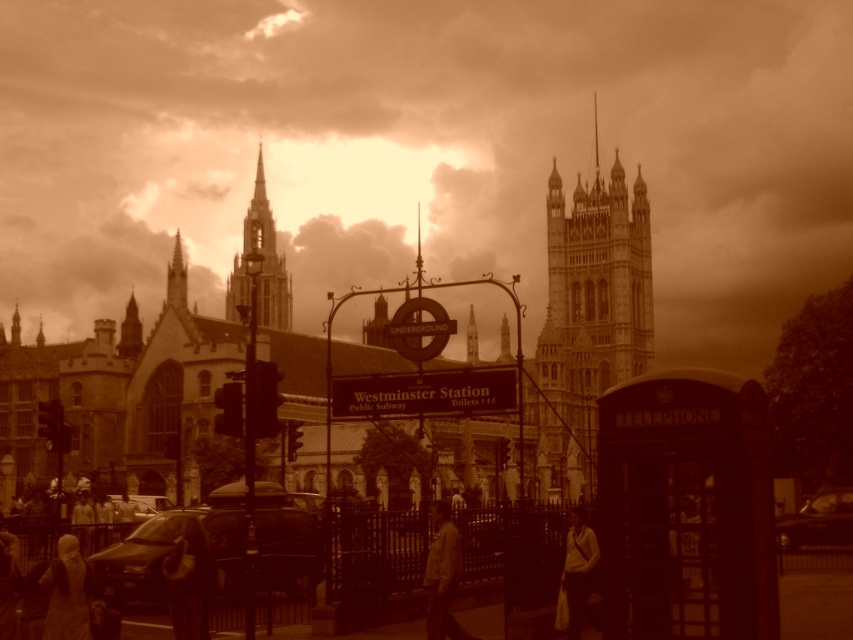
Question: Which point is closer to the camera?

Choices:
 (A) dark textured coat at lower left
 (B) dark matte car at lower left
 (C) brown leather jacket at center
 (D) light brown fabric shirt at lower right

Answer: (A)

Question: Does dark textured coat at lower left appear on the right side of brown leather jacket at center?

Choices:
 (A) no
 (B) yes

Answer: (A)

Question: Is matte stone tower at upper left thinner than shiny black car at lower right?

Choices:
 (A) yes
 (B) no

Answer: (A)

Question: Among these points, which one is farthest from the camera?

Choices:
 (A) (306, 592)
 (B) (267, 266)
 (C) (184, 620)

Answer: (B)

Question: Can you confirm if stone gothic tower at center is positioned to the right of brown leather jacket at center?

Choices:
 (A) no
 (B) yes

Answer: (B)

Question: Which of the following is the farthest from the observer?

Choices:
 (A) shiny black car at lower right
 (B) matte stone tower at upper left

Answer: (B)